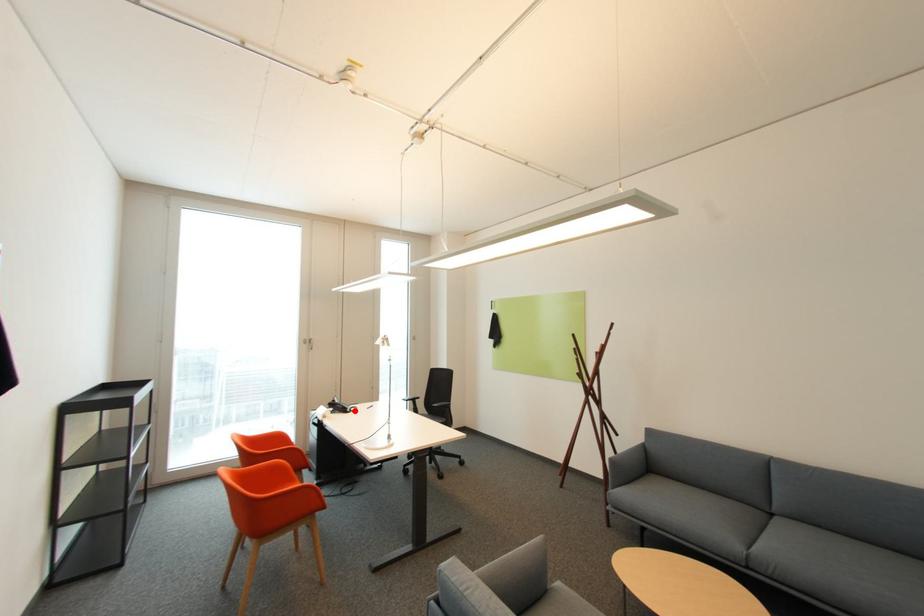
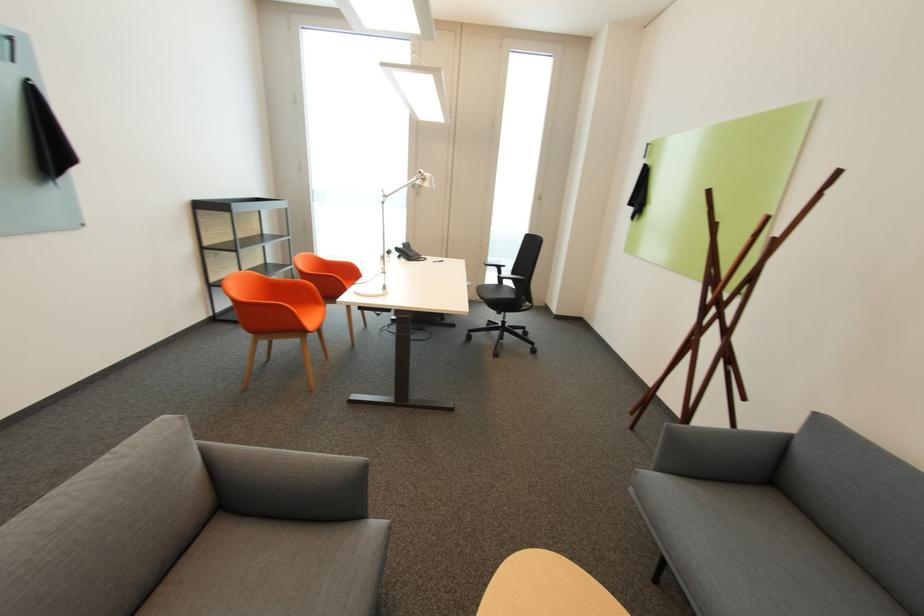
Locate, in the second image, the point that corresponds to the highlighted location in the first image.

(419, 259)